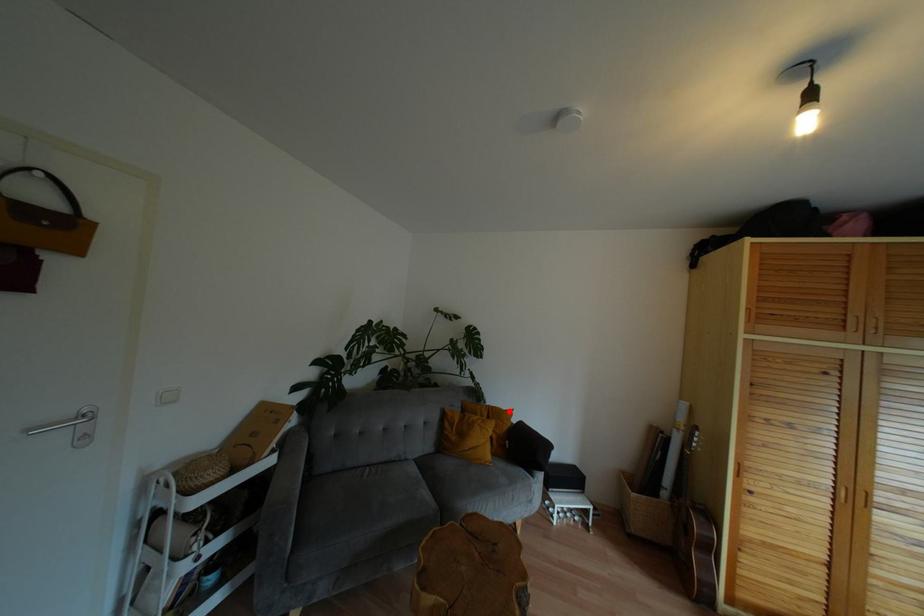
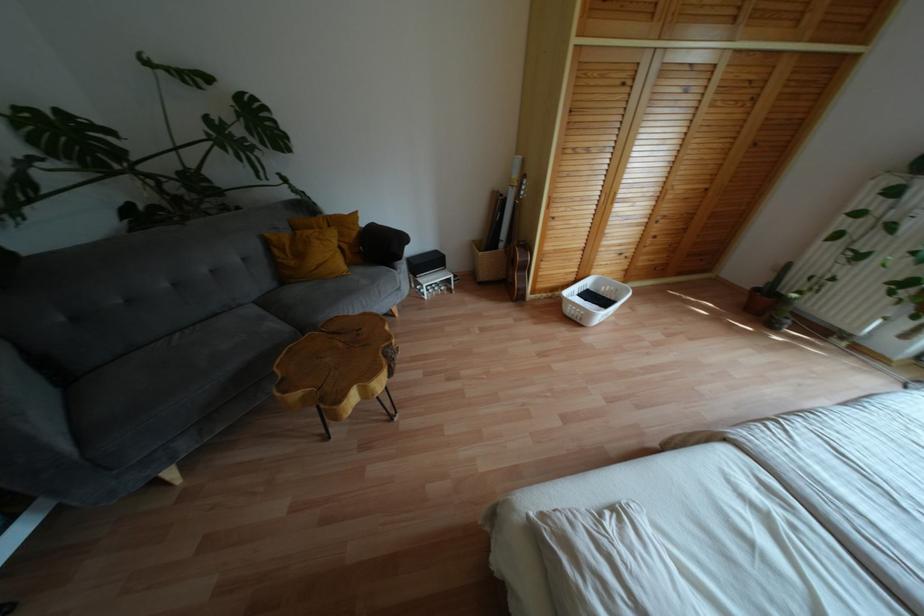
Question: A red point is marked in image1. In image2, is the corresponding 3D point closer to the camera or farther? Reply with the corresponding letter.

Choices:
 (A) The corresponding 3D point is closer.
 (B) The corresponding 3D point is farther.

Answer: (A)